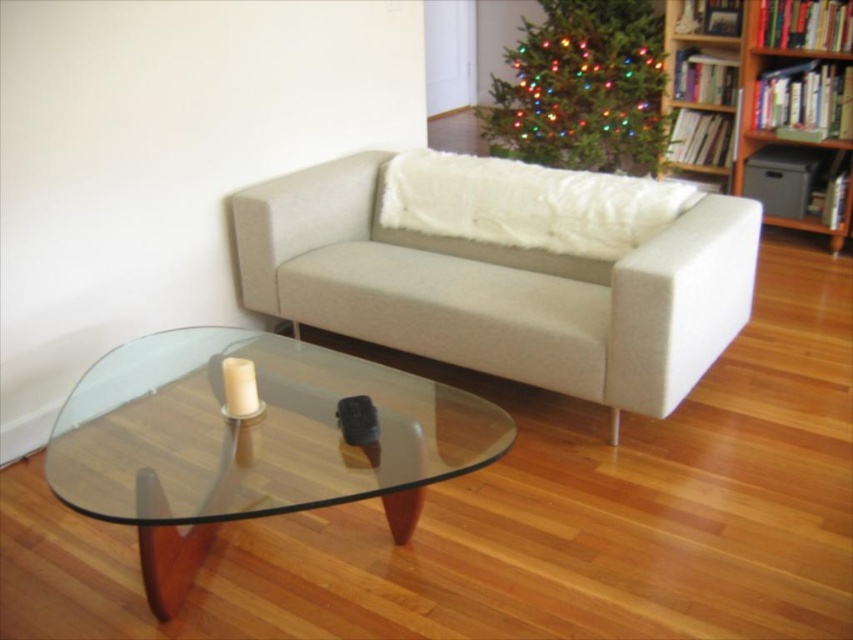
Question: Is wooden bookshelf at upper right wider than multicolored lights christmas tree at upper center?

Choices:
 (A) yes
 (B) no

Answer: (B)

Question: Is transparent glass coffee table at center to the right of multicolored lights christmas tree at upper center from the viewer's perspective?

Choices:
 (A) no
 (B) yes

Answer: (A)

Question: Which point is closer to the camera?

Choices:
 (A) (633, 45)
 (B) (793, 157)

Answer: (B)

Question: Which of the following is the closest to the observer?

Choices:
 (A) wooden bookshelf at upper right
 (B) multicolored lights christmas tree at upper center

Answer: (A)

Question: Which point is closer to the camera?

Choices:
 (A) transparent glass coffee table at center
 (B) wooden bookshelf at upper right

Answer: (A)

Question: Considering the relative positions of wooden bookshelf at upper right and multicolored lights christmas tree at upper center in the image provided, where is wooden bookshelf at upper right located with respect to multicolored lights christmas tree at upper center?

Choices:
 (A) right
 (B) left

Answer: (A)